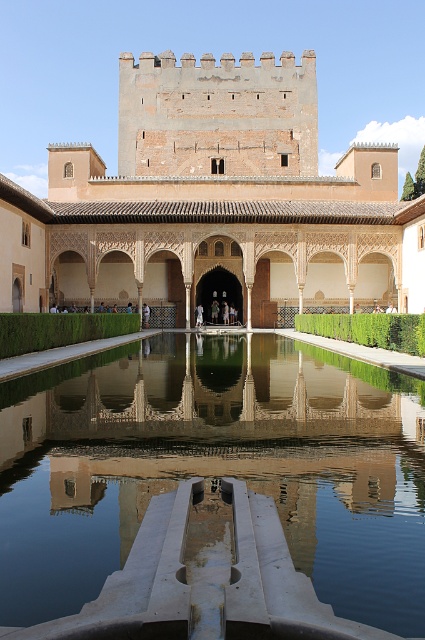
Question: Which object is farther from the camera taking this photo?

Choices:
 (A) clear glass water at center
 (B) brown stone palace at center

Answer: (B)

Question: Which object appears farthest from the camera in this image?

Choices:
 (A) clear glass water at center
 (B) brown stone palace at center

Answer: (B)

Question: Which point appears farthest from the camera in this image?

Choices:
 (A) (365, 387)
 (B) (102, 161)

Answer: (B)

Question: Is clear glass water at center to the right of brown stone palace at center from the viewer's perspective?

Choices:
 (A) yes
 (B) no

Answer: (A)

Question: Is clear glass water at center thinner than brown stone palace at center?

Choices:
 (A) yes
 (B) no

Answer: (A)

Question: Does clear glass water at center have a greater width compared to brown stone palace at center?

Choices:
 (A) no
 (B) yes

Answer: (A)